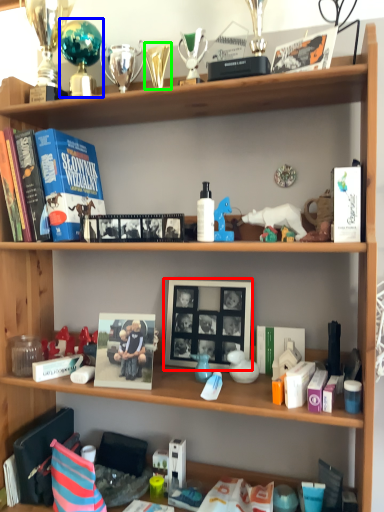
Question: Based on their relative distances, which object is nearer to picture frame (highlighted by a red box)? Choose from toy (highlighted by a blue box) and toy (highlighted by a green box).

Choices:
 (A) toy
 (B) toy

Answer: (B)